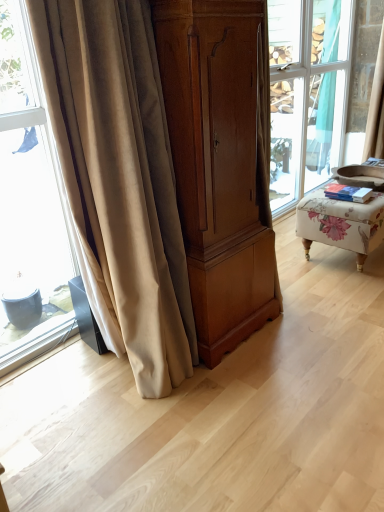
Identify the location of free location in front of beige velvet curtain at left, the 1th curtain positioned from the front. (148, 438).